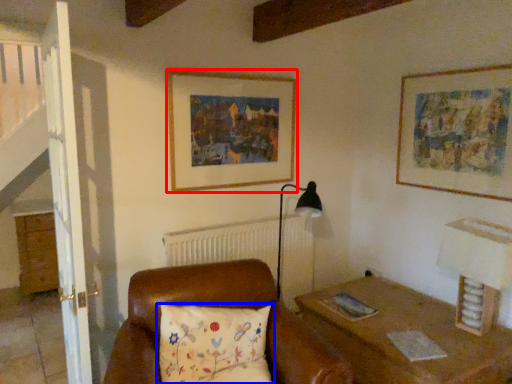
Question: Which of the following is the farthest to the observer, picture frame (highlighted by a red box) or pillow (highlighted by a blue box)?

Choices:
 (A) picture frame
 (B) pillow

Answer: (A)